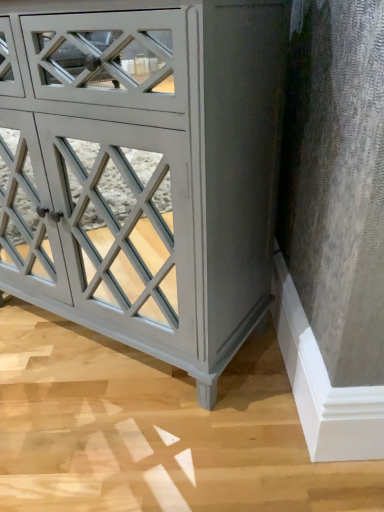
What is the approximate height of matte gray cabinet at center?

The height of matte gray cabinet at center is 31.74 inches.

The height and width of the screenshot is (512, 384). What do you see at coordinates (144, 169) in the screenshot?
I see `matte gray cabinet at center` at bounding box center [144, 169].

Locate an element on the screen. matte gray cabinet at center is located at coordinates (144, 169).

This screenshot has width=384, height=512. I want to click on matte gray cabinet at center, so click(144, 169).